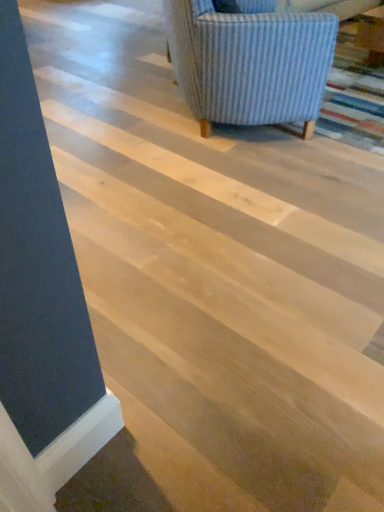
This screenshot has width=384, height=512. Describe the element at coordinates (250, 63) in the screenshot. I see `blue striped fabric chair at upper right` at that location.

You are a GUI agent. You are given a task and a screenshot of the screen. Output one action in this format:
    pyautogui.click(x=<x>, y=<y>)
    Task: Click on the blue striped fabric chair at upper right
    The image size is (384, 512).
    Given the screenshot: What is the action you would take?
    pyautogui.click(x=250, y=63)

Measure the distance between blue striped fabric chair at upper right and camera.

A distance of 6.32 feet exists between blue striped fabric chair at upper right and camera.

Locate an element on the screen. Image resolution: width=384 pixels, height=512 pixels. blue striped fabric chair at upper right is located at coordinates (250, 63).